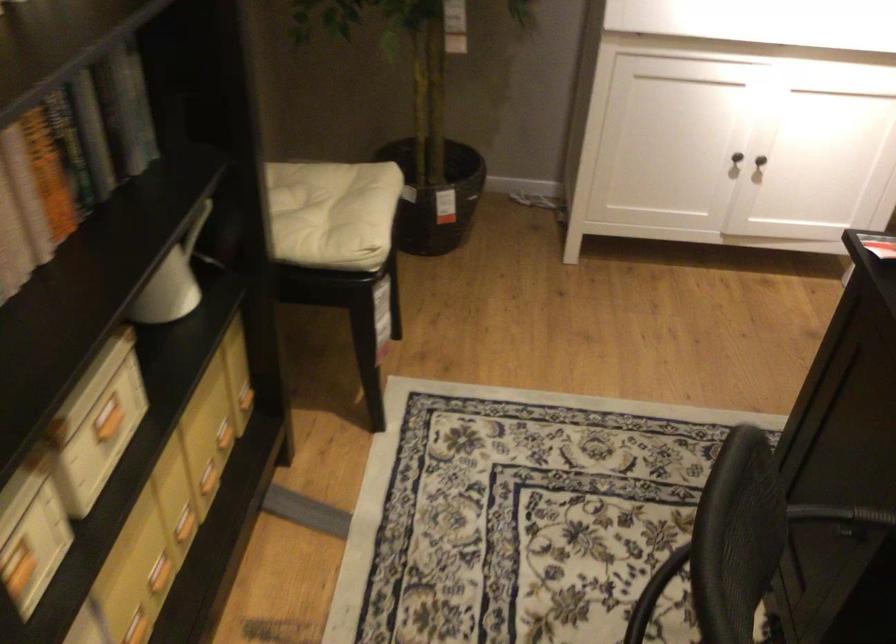
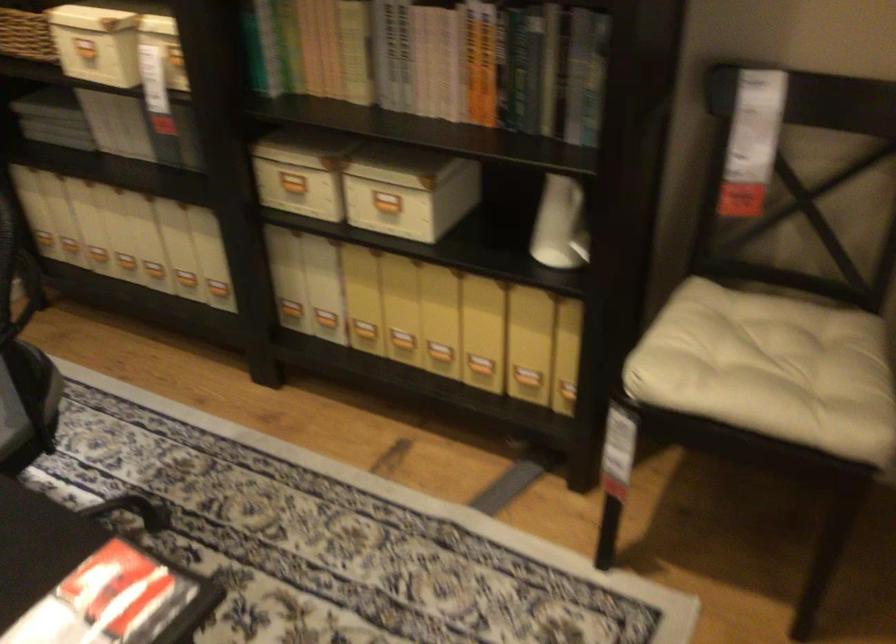
Find the pixel in the second image that matches pixel 73 468 in the first image.

(386, 204)